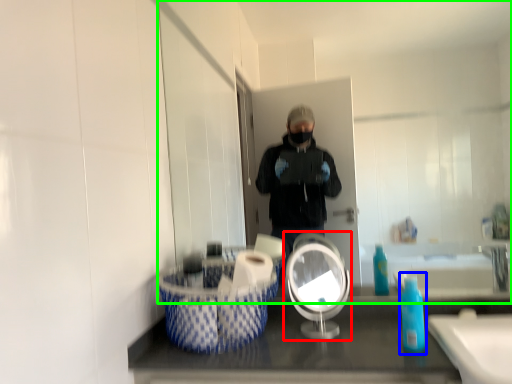
Question: Which object is the farthest from mirror (highlighted by a red box)? Choose among these: soap dispenser (highlighted by a blue box) or mirror (highlighted by a green box).

Choices:
 (A) soap dispenser
 (B) mirror

Answer: (B)